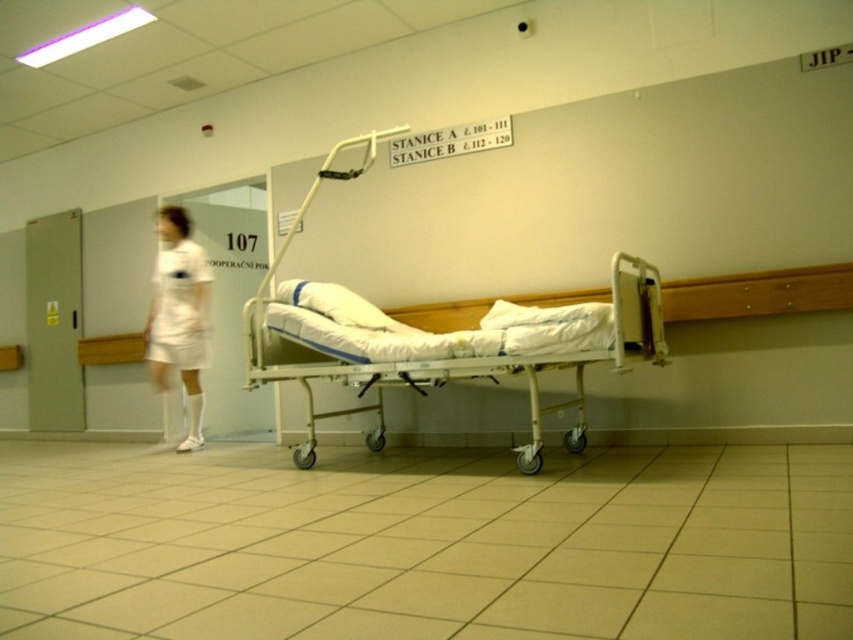
You are a nurse trying to move the white plastic hospital bed at center into a patient room. The doorway is only 2 meters tall. Can the bed fit through the doorway based on its height compared to the white matte uniform at left?

The white plastic hospital bed at center is shorter than the white matte uniform at left. Since the uniform is likely taller than 2 meters, the bed might not fit through the doorway. However, without knowing the exact height of the uniform, we cannot confirm for certain.

You are a patient trying to locate the nurse in the hospital corridor. You see the white plastic hospital bed at center and the white matte uniform at left. Which object is closer to the left side of the corridor?

The white matte uniform at left is closer to the left side of the corridor since it is positioned to the left of the white plastic hospital bed at center.